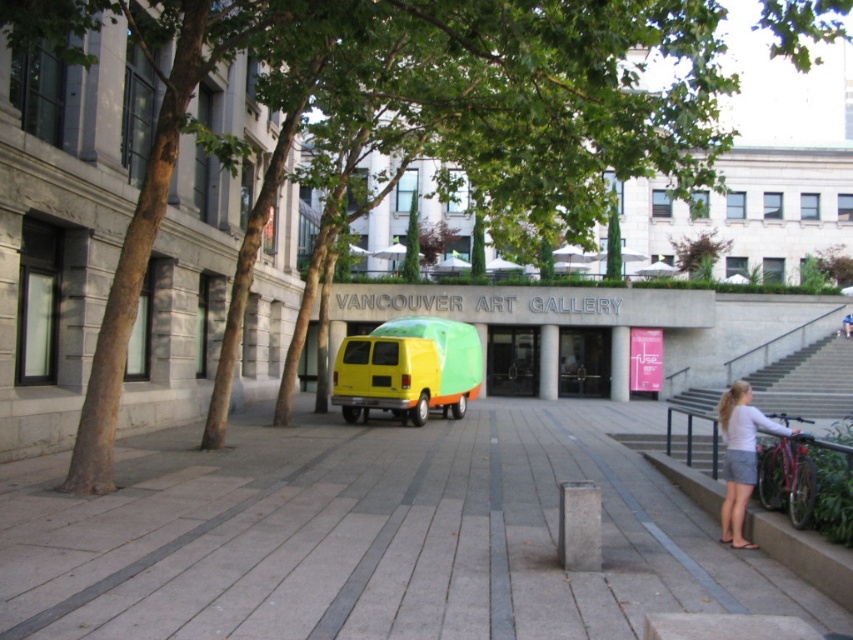
Image resolution: width=853 pixels, height=640 pixels. What do you see at coordinates (373, 536) in the screenshot?
I see `gray concrete pavement at center` at bounding box center [373, 536].

Looking at this image, who is taller, gray concrete pavement at center or concrete stairs at right?

concrete stairs at right is taller.

Locate an element on the screen. The width and height of the screenshot is (853, 640). gray concrete pavement at center is located at coordinates (373, 536).

Between gray concrete pavement at center and yellow matte van at center, which one is positioned higher?

yellow matte van at center is above.

Is point (379, 436) in front of point (383, 342)?

That is True.

Does point (677, 529) lie in front of point (405, 378)?

Yes, it is.

Where is `gray concrete pavement at center`? gray concrete pavement at center is located at coordinates (373, 536).

Where is `yellow matte van at center`? The image size is (853, 640). yellow matte van at center is located at coordinates (408, 369).

In the scene shown: Who is more forward, (360, 404) or (729, 412)?

Point (729, 412)

Image resolution: width=853 pixels, height=640 pixels. Find the location of `yellow matte van at center`. yellow matte van at center is located at coordinates (408, 369).